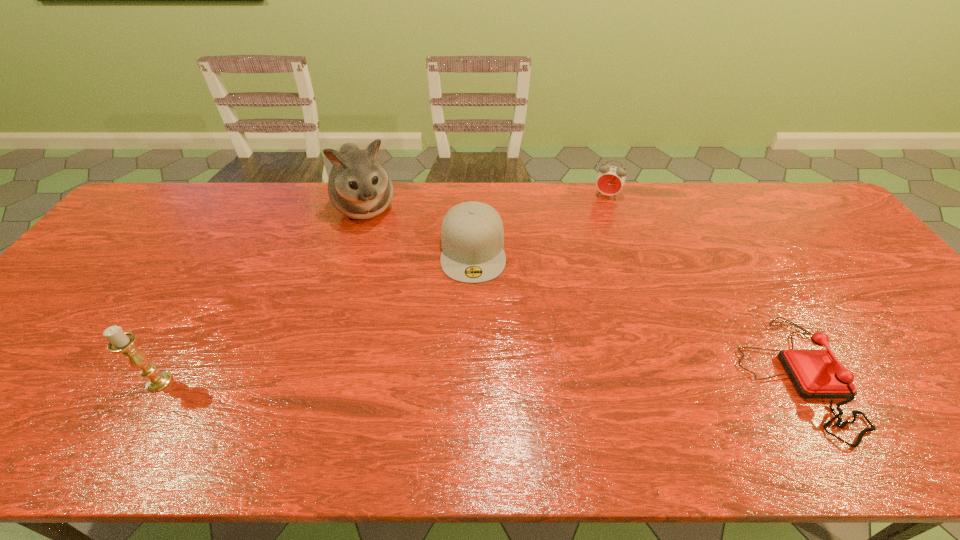
Identify the location of vacant space located on the front-facing side of the fourth tallest object. [x=474, y=315].

What are the coordinates of `hamster at the far edge` in the screenshot? It's located at (359, 187).

Where is `alarm clock that is at the far edge`? alarm clock that is at the far edge is located at coordinates (610, 180).

Locate an element on the screen. This screenshot has width=960, height=540. cap that is at the far edge is located at coordinates (472, 236).

The height and width of the screenshot is (540, 960). Identify the location of candle holder that is at the near edge. (122, 342).

This screenshot has height=540, width=960. Find the location of `telephone present at the near edge`. telephone present at the near edge is located at coordinates (815, 373).

Locate an element on the screen. free space at the far edge of the desktop is located at coordinates (269, 192).

Locate an element on the screen. vacant space at the near edge is located at coordinates (591, 404).

In the image, there is a desktop. Where is `free space at the left edge`? free space at the left edge is located at coordinates (123, 285).

At what (x,y) coordinates should I click in order to perform the action: click on vacant space at the right edge. Please return your answer as a coordinate pair (x, y). The image size is (960, 540). Looking at the image, I should click on (941, 346).